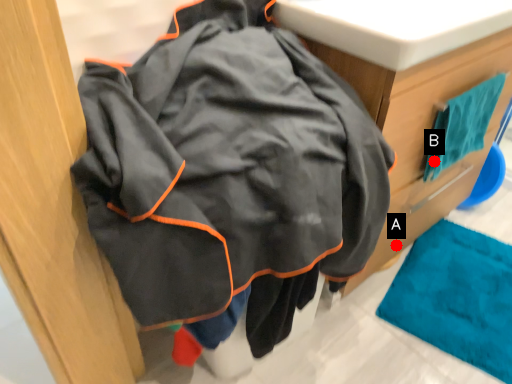
Question: Two points are circled on the image, labeled by A and B beside each circle. Which point appears closest to the camera in this image?

Choices:
 (A) A is closer
 (B) B is closer

Answer: (B)